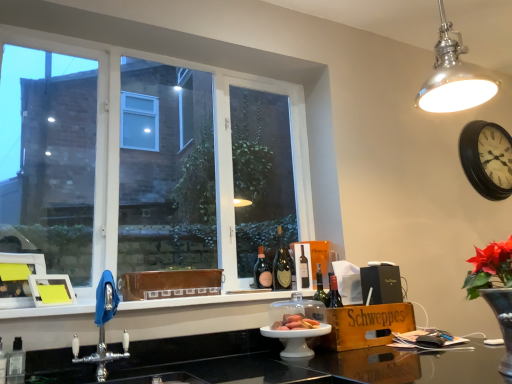
You are a GUI agent. You are given a task and a screenshot of the screen. Output one action in this format:
    pyautogui.click(x=<x>, y=<y>)
    Task: Click on the free point below matte brown bread at center (from a real-world perspective)
    This screenshot has height=384, width=512.
    Given the screenshot: What is the action you would take?
    pyautogui.click(x=297, y=321)